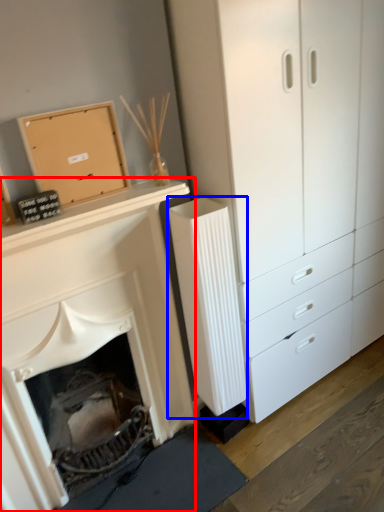
Question: Which object appears farthest to the camera in this image, fireplace (highlighted by a red box) or radiator (highlighted by a blue box)?

Choices:
 (A) fireplace
 (B) radiator

Answer: (B)